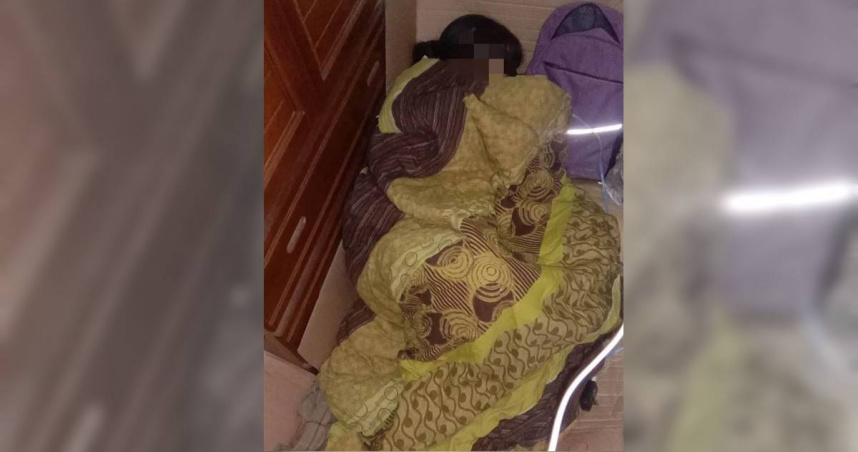
Image resolution: width=858 pixels, height=452 pixels. I want to click on wall, so click(x=511, y=24).